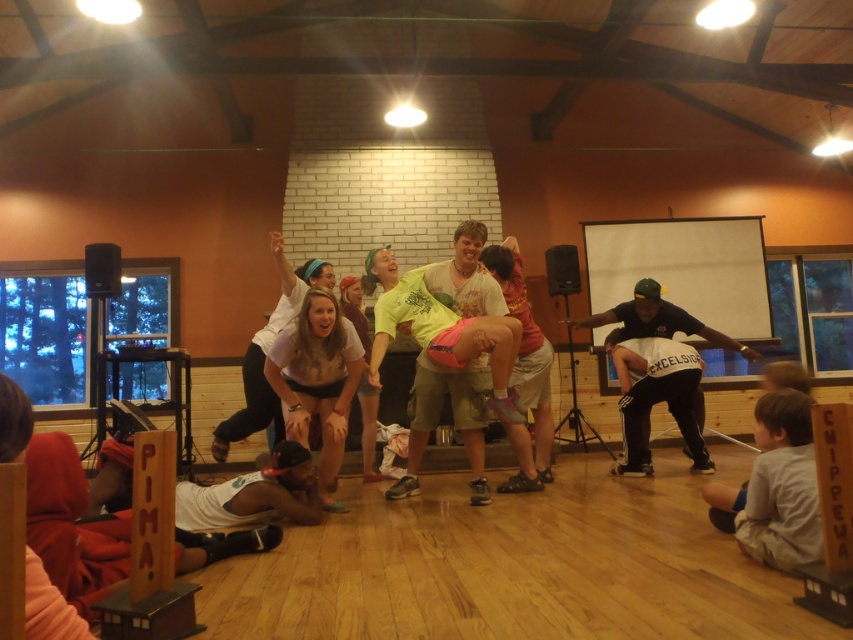
Looking at this image, does gray cotton shirt at lower right have a smaller size compared to white matte shorts at center?

Indeed, gray cotton shirt at lower right has a smaller size compared to white matte shorts at center.

Which of these two, gray cotton shirt at lower right or white matte shorts at center, stands shorter?

With less height is gray cotton shirt at lower right.

Locate an element on the screen. The height and width of the screenshot is (640, 853). gray cotton shirt at lower right is located at coordinates (781, 484).

Who is taller, white matte shorts at center or black athletic pants at right?

white matte shorts at center

Is point (354, 336) positioned after point (639, 417)?

No, (354, 336) is closer to viewer.

Who is more forward, (331, 300) or (668, 372)?

Point (331, 300) is in front.

You are a GUI agent. You are given a task and a screenshot of the screen. Output one action in this format:
    pyautogui.click(x=<x>, y=<y>)
    Task: Click on the white matte shorts at center
    The image size is (853, 640).
    Given the screenshot: What is the action you would take?
    pyautogui.click(x=317, y=380)

Identify the location of gray cotton shirt at lower right. The image size is (853, 640). click(x=781, y=484).

Is gray cotton shirt at lower right positioned behind black athletic pants at right?

No, it is in front of black athletic pants at right.

Identify the location of gray cotton shirt at lower right. Image resolution: width=853 pixels, height=640 pixels. coord(781,484).